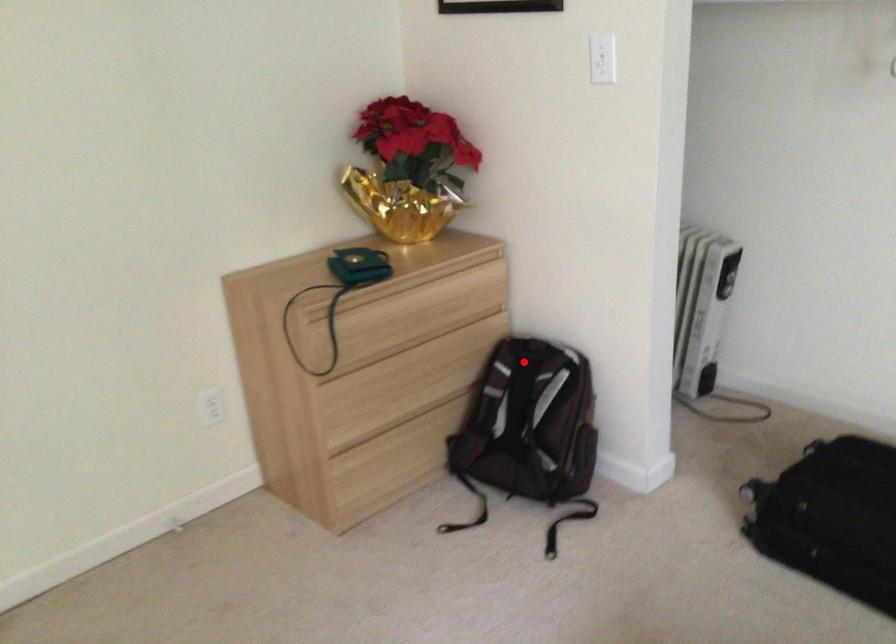
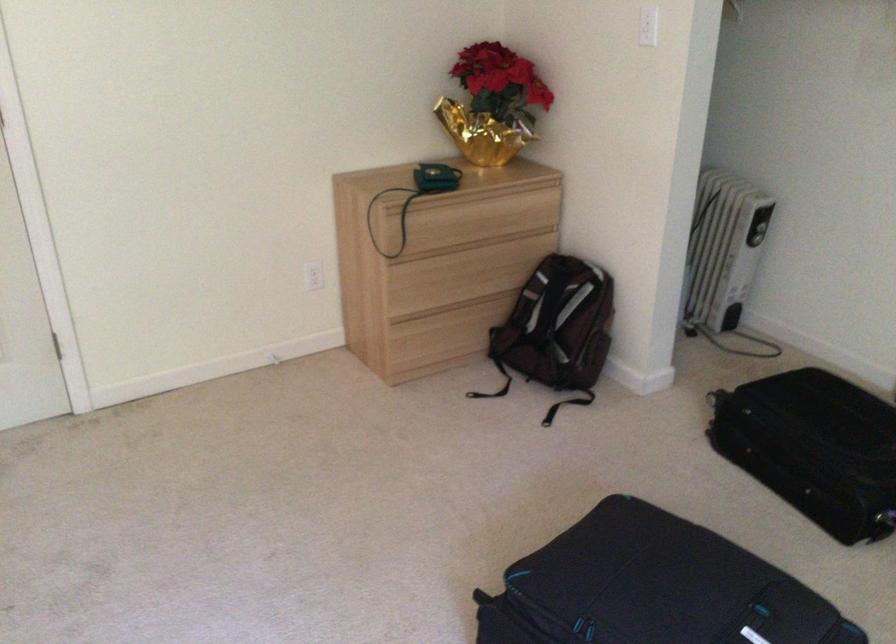
Question: I am providing you with two images of the same scene from different viewpoints. Image1 has a red point marked. In image2, the corresponding 3D location appears at what relative position? Reply with the corresponding letter.

Choices:
 (A) Closer
 (B) Farther

Answer: (B)